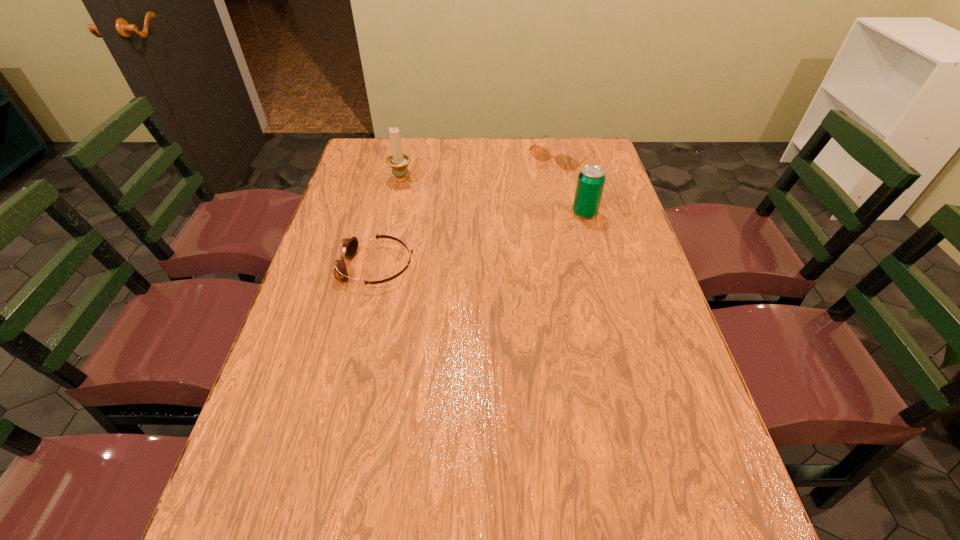
The image size is (960, 540). Find the location of `vacant space located 0.110m on the handle side of the candle_holder`. vacant space located 0.110m on the handle side of the candle_holder is located at coordinates (429, 200).

The height and width of the screenshot is (540, 960). In order to click on free point located 0.260m on the handle side of the candle_holder in this screenshot , I will do `click(459, 222)`.

This screenshot has width=960, height=540. What are the coordinates of `vacant space located 0.310m on the handle side of the candle_holder` in the screenshot? It's located at (470, 230).

The image size is (960, 540). Identify the location of sunglasses present at the far edge. (566, 162).

Image resolution: width=960 pixels, height=540 pixels. Identify the location of candle_holder that is at the far edge. (398, 161).

At what (x,y) coordinates should I click in order to perform the action: click on goggles at the left edge. Please return your answer as a coordinate pair (x, y). Looking at the image, I should click on (349, 246).

Image resolution: width=960 pixels, height=540 pixels. In order to click on candle_holder that is at the left edge in this screenshot , I will do `click(398, 161)`.

Locate an element on the screen. This screenshot has height=540, width=960. beer can that is positioned at the right edge is located at coordinates (590, 184).

Locate an element on the screen. The height and width of the screenshot is (540, 960). sunglasses positioned at the right edge is located at coordinates (566, 162).

Identify the location of object located at the far left corner. (398, 161).